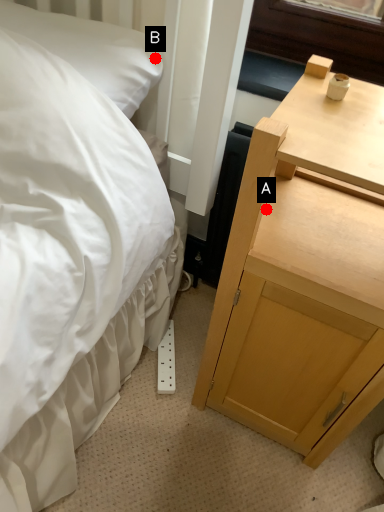
Question: Two points are circled on the image, labeled by A and B beside each circle. Which point appears closest to the camera in this image?

Choices:
 (A) A is closer
 (B) B is closer

Answer: (A)